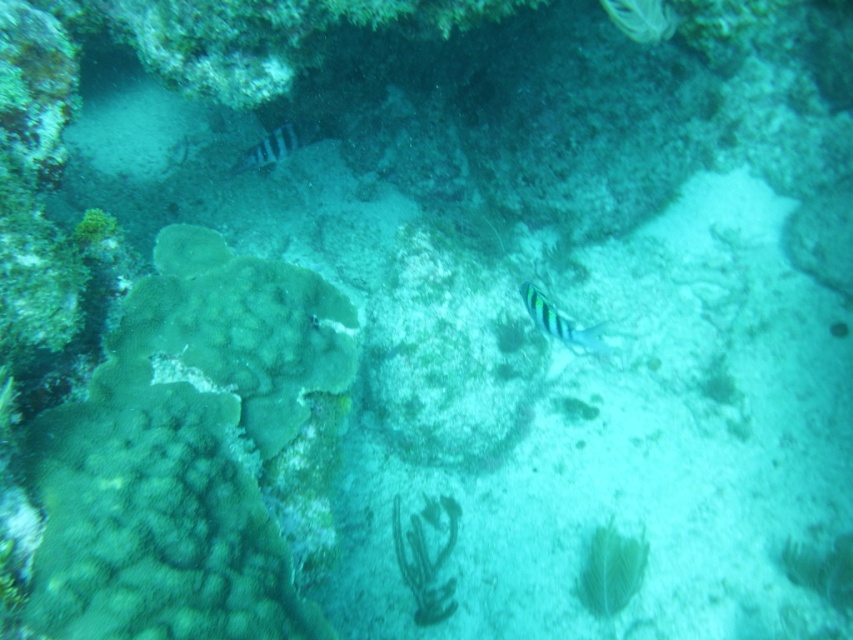
Question: Among these points, which one is farthest from the camera?

Choices:
 (A) (264, 148)
 (B) (584, 337)

Answer: (A)

Question: Is striped matte fish at center thinner than striped blue-green fish at upper left?

Choices:
 (A) yes
 (B) no

Answer: (A)

Question: Is striped matte fish at center thinner than striped blue-green fish at upper left?

Choices:
 (A) yes
 (B) no

Answer: (A)

Question: Does striped matte fish at center appear over striped blue-green fish at upper left?

Choices:
 (A) yes
 (B) no

Answer: (B)

Question: Which of the following is the farthest from the observer?

Choices:
 (A) striped blue-green fish at upper left
 (B) striped matte fish at center

Answer: (A)

Question: Which point is closer to the camera taking this photo?

Choices:
 (A) (265, 157)
 (B) (601, 326)

Answer: (B)